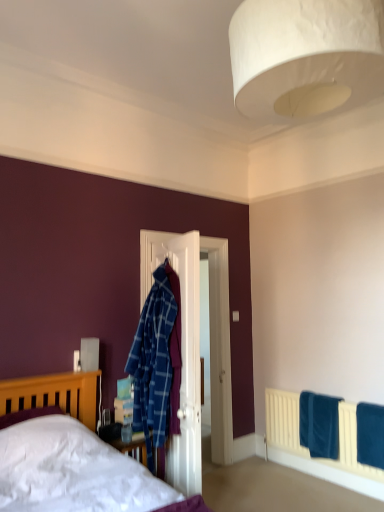
Question: From a real-world perspective, relative to blue soft towel at lower right, which appears as the 1th bath towel when viewed from the back, is blue soft towel at lower right, which is the second bath towel in back-to-front order, vertically above or below?

Choices:
 (A) above
 (B) below

Answer: (A)

Question: In the image, is blue soft towel at lower right, which is the second bath towel in back-to-front order, on the left side or the right side of blue soft towel at lower right, the second bath towel viewed from the front?

Choices:
 (A) right
 (B) left

Answer: (A)

Question: Estimate the real-world distances between objects in this image. Which object is farther from the blue soft towel at lower right, the first bath towel when ordered from front to back?

Choices:
 (A) blue soft towel at lower right, the second bath towel viewed from the front
 (B) white wooden door at center
 (C) white paper lampshade at upper center
 (D) matte wooden bed at lower left

Answer: (C)

Question: Estimate the real-world distances between objects in this image. Which object is closer to the white paper lampshade at upper center?

Choices:
 (A) blue soft towel at lower right, which is the second bath towel in back-to-front order
 (B) blue soft towel at lower right, acting as the first bath towel starting from the left
 (C) white wooden door at center
 (D) matte wooden bed at lower left

Answer: (C)